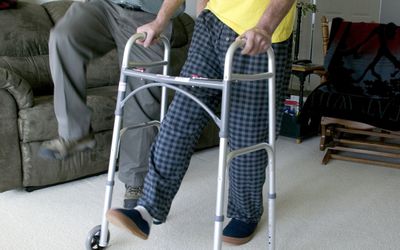
I want to click on sock, so click(x=144, y=214).